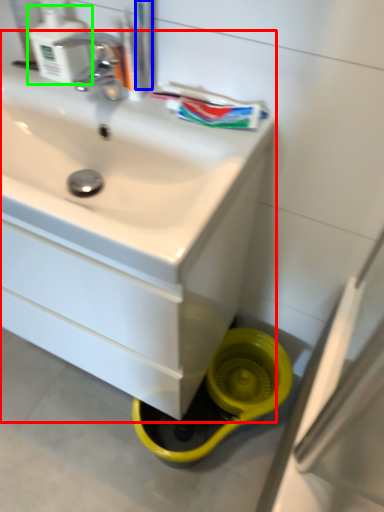
Question: Estimate the real-world distances between objects in this image. Which object is farther from sink (highlighted by a red box), toothbrush (highlighted by a blue box) or soap dispenser (highlighted by a green box)?

Choices:
 (A) toothbrush
 (B) soap dispenser

Answer: (A)